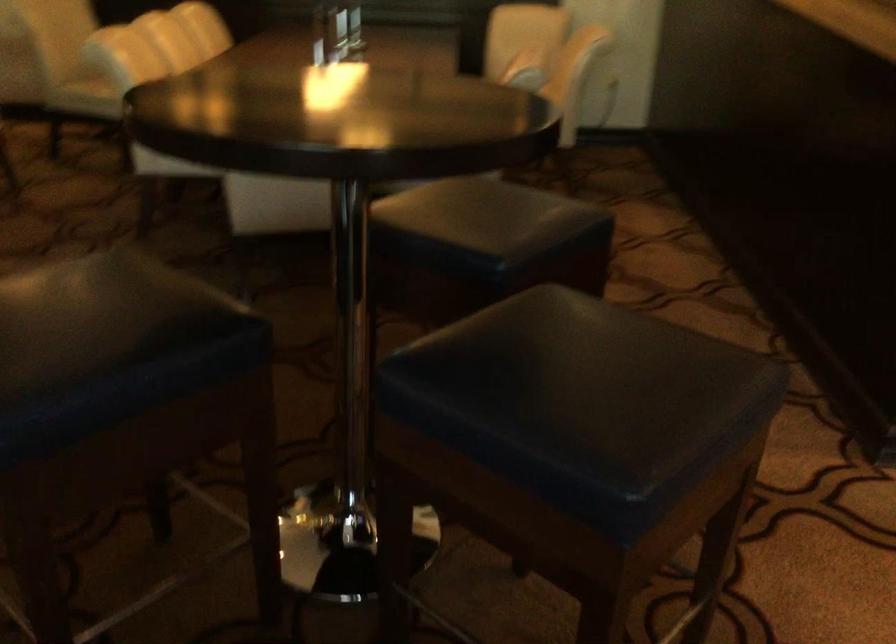
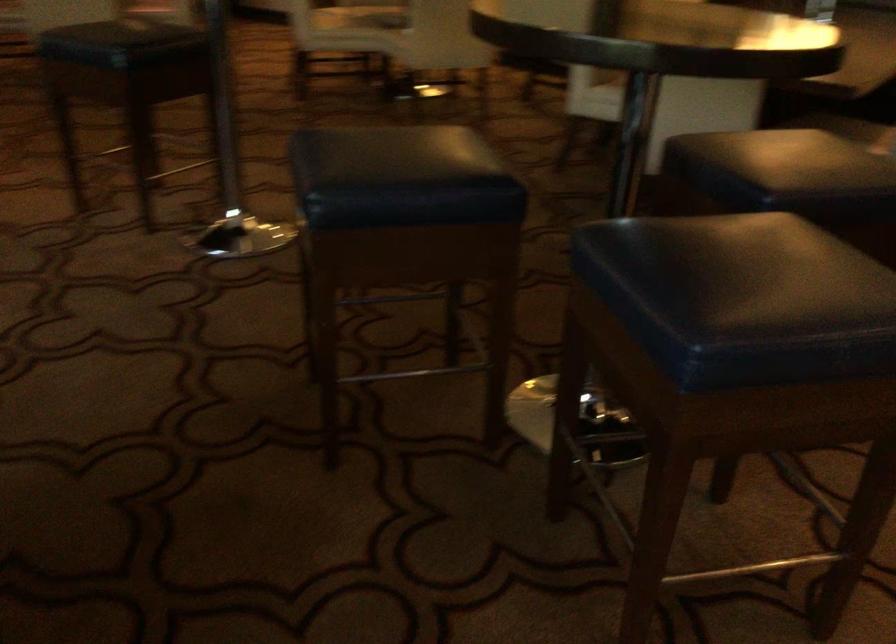
Find the pixel in the second image that matches point 501,234 in the first image.

(778, 167)